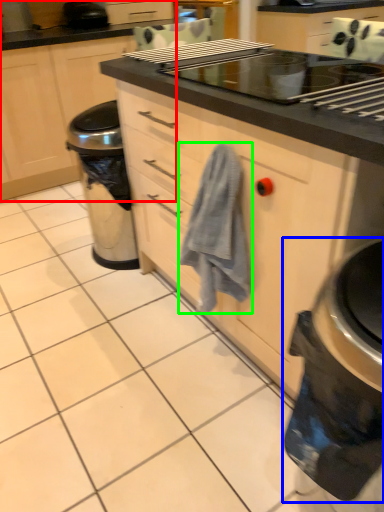
Question: Which is nearer to the cabinetry (highlighted by a red box)? home appliance (highlighted by a blue box) or bath towel (highlighted by a green box).

Choices:
 (A) home appliance
 (B) bath towel

Answer: (B)